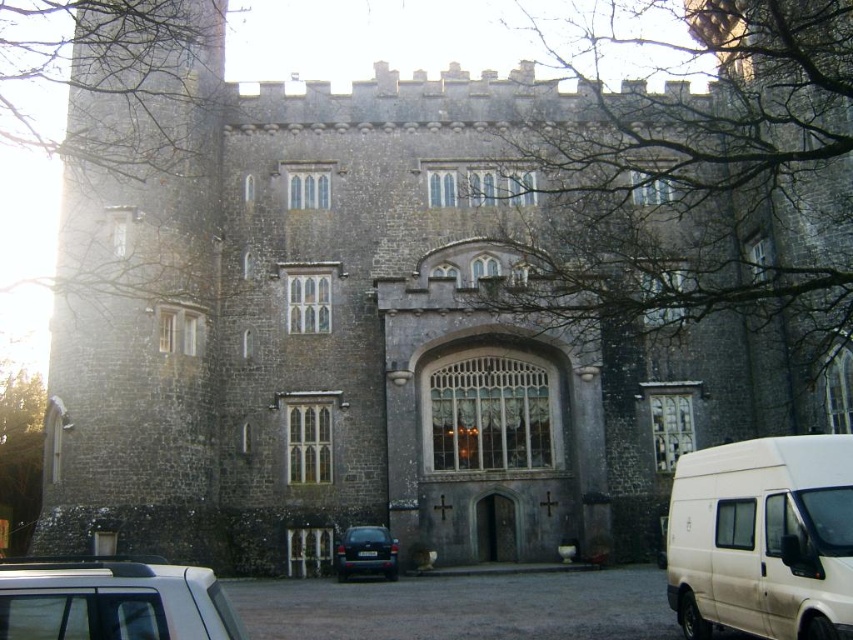
Question: Which object is closer to the camera taking this photo?

Choices:
 (A) dark blue matte car at lower center
 (B) white matte van at lower right

Answer: (B)

Question: Is white matte van at lower right to the right of dark blue matte car at lower center from the viewer's perspective?

Choices:
 (A) yes
 (B) no

Answer: (A)

Question: Can you confirm if white matte van at lower right is thinner than silver metallic car at lower left?

Choices:
 (A) no
 (B) yes

Answer: (B)

Question: Which point appears farthest from the camera in this image?

Choices:
 (A) (793, 618)
 (B) (151, 584)
 (C) (347, 572)

Answer: (C)

Question: Which point is closer to the camera taking this photo?

Choices:
 (A) (35, 573)
 (B) (788, 506)
 (C) (345, 580)

Answer: (A)

Question: Does silver metallic car at lower left appear under dark blue matte car at lower center?

Choices:
 (A) yes
 (B) no

Answer: (B)